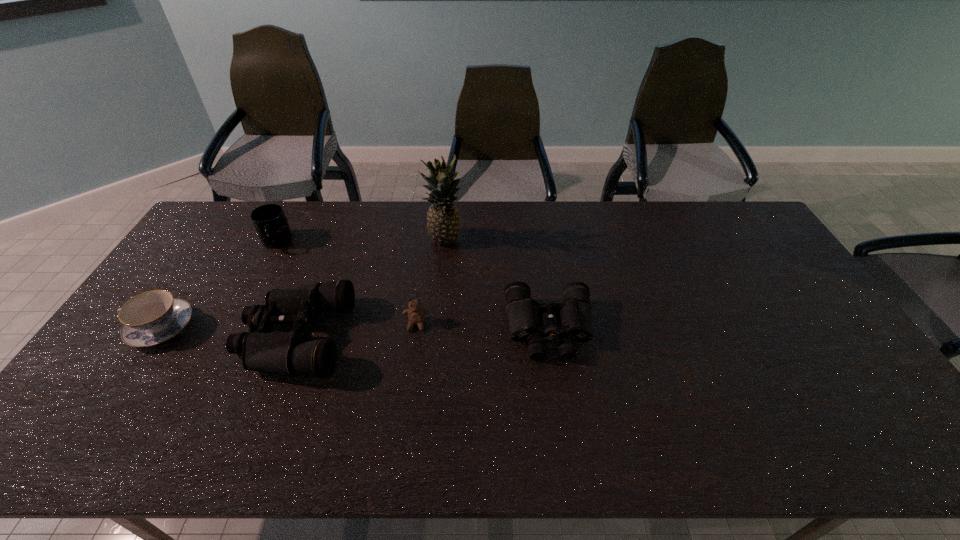
Locate an element on the screen. The image size is (960, 540). free location that satisfies the following two spatial constraints: 1. with the handle on the side of the tallest object; 2. on the right side of the chinaware is located at coordinates (219, 241).

At what (x,y) coordinates should I click in order to perform the action: click on free region that satisfies the following two spatial constraints: 1. on the front-facing side of the teddy bear; 2. through the eyepieces of the left binoculars. Please return your answer as a coordinate pair (x, y). This screenshot has width=960, height=540. Looking at the image, I should click on (415, 338).